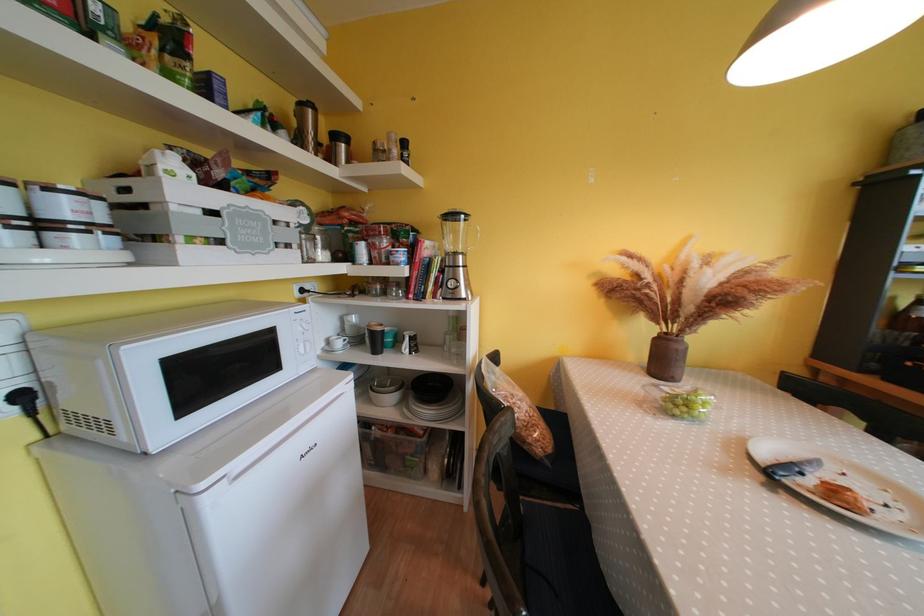
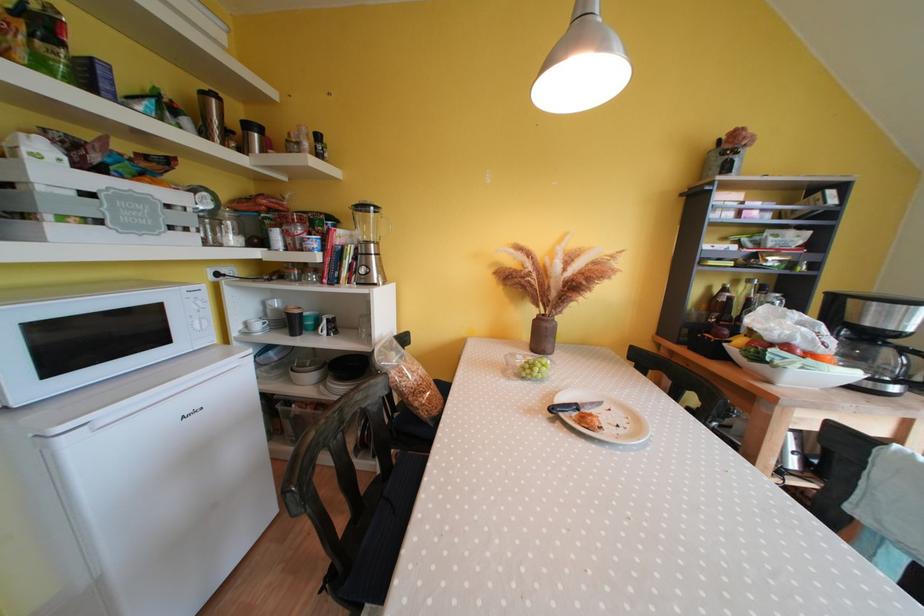
Find the pixel in the second image that matches (x=687, y=351) in the first image.

(554, 330)